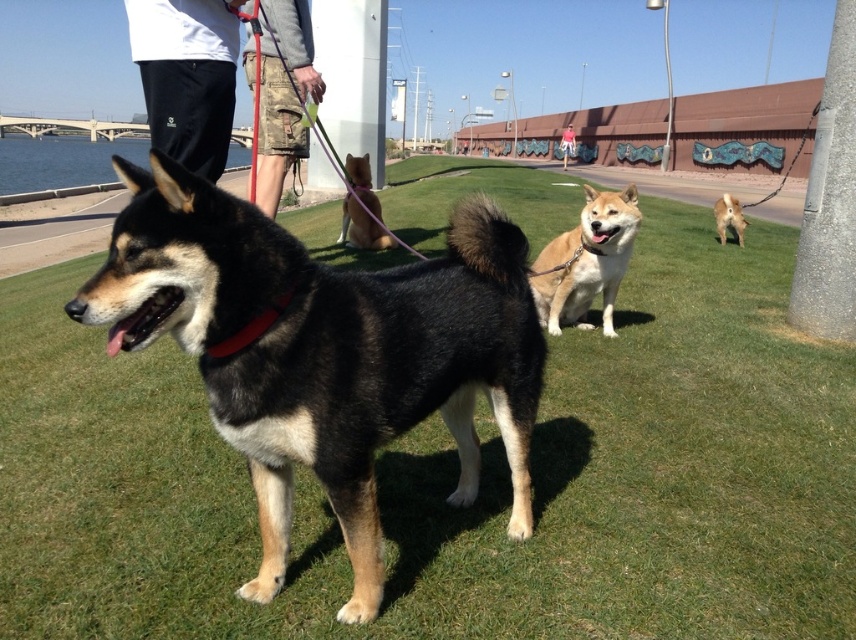
Question: Which point appears closest to the camera in this image?

Choices:
 (A) (734, 212)
 (B) (206, 3)
 (C) (578, 301)

Answer: (B)

Question: Estimate the real-world distances between objects in this image. Which object is farther from the black cotton pants at upper left?

Choices:
 (A) black fur dog at center
 (B) camo shorts at center
 (C) golden fur dog at center

Answer: (C)

Question: Is light brown fur at center smaller than red fabric collar at center?

Choices:
 (A) no
 (B) yes

Answer: (A)

Question: Is black cotton pants at upper left in front of red fabric collar at center?

Choices:
 (A) no
 (B) yes

Answer: (A)

Question: Among these objects, which one is nearest to the camera?

Choices:
 (A) black cotton pants at upper left
 (B) camo shorts at center
 (C) light brown fur at center
 (D) red fabric collar at center

Answer: (D)

Question: Can you confirm if black cotton pants at upper left is positioned below camo shorts at center?

Choices:
 (A) yes
 (B) no

Answer: (A)